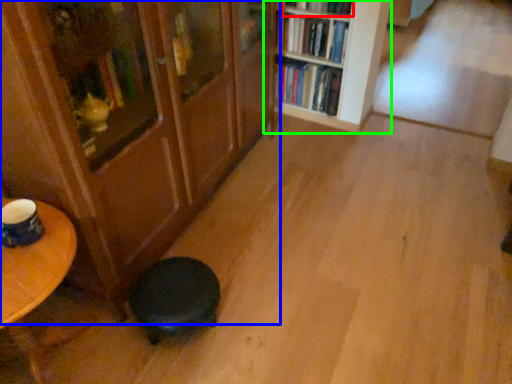
Question: Based on their relative distances, which object is farther from book (highlighted by a red box)? Choose from bookcase (highlighted by a blue box) and bookcase (highlighted by a green box).

Choices:
 (A) bookcase
 (B) bookcase

Answer: (A)